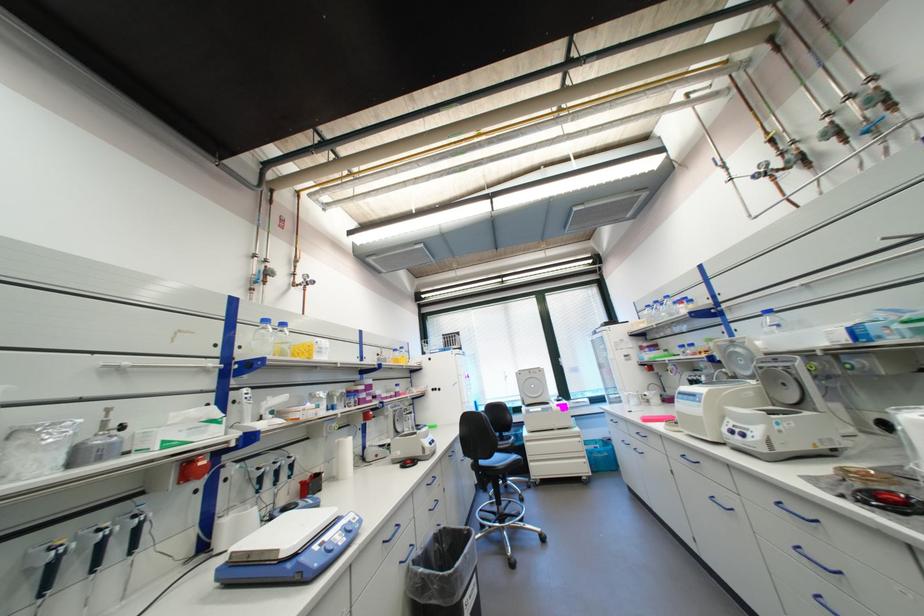
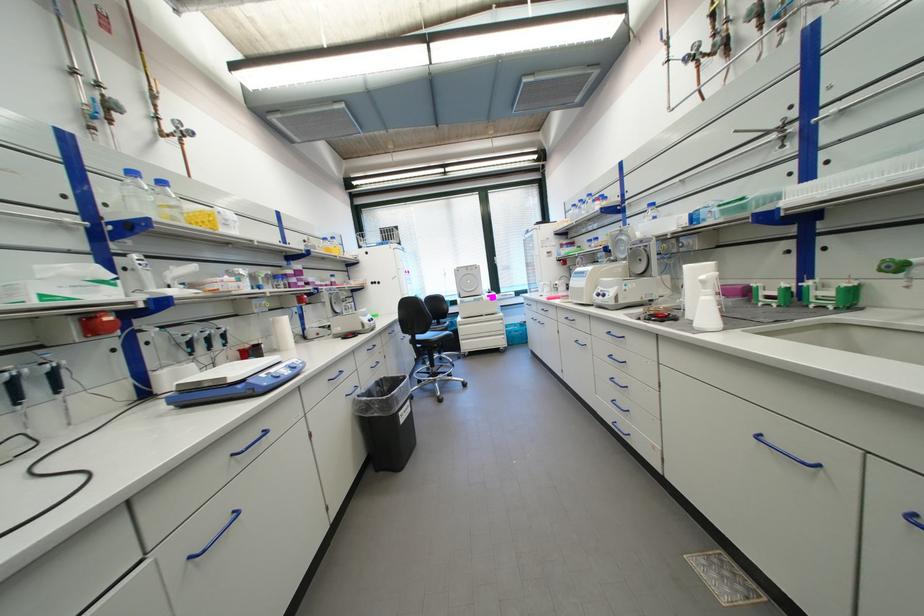
Find the pixel in the second image that matches pixel 274 322 in the first image.

(140, 174)